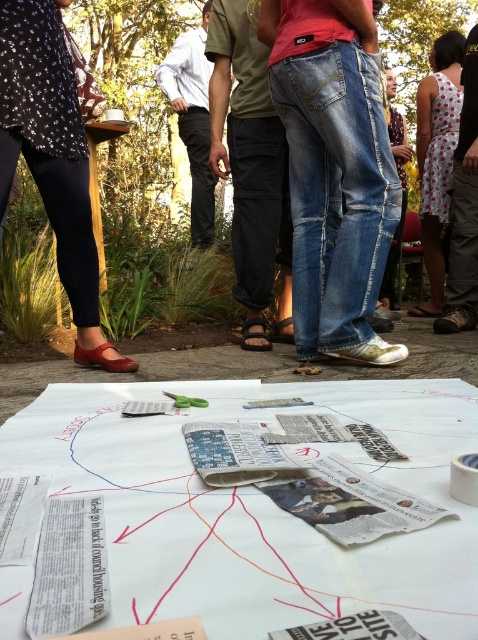
Between white dotted dress at center and jeans at center, which one has less height?

Standing shorter between the two is white dotted dress at center.

Who is positioned more to the right, white dotted dress at center or jeans at center?

white dotted dress at center

What do you see at coordinates (436, 157) in the screenshot? The width and height of the screenshot is (478, 640). I see `white dotted dress at center` at bounding box center [436, 157].

You are a GUI agent. You are given a task and a screenshot of the screen. Output one action in this format:
    pyautogui.click(x=<x>, y=<y>)
    Task: Click on the white dotted dress at center
    The width and height of the screenshot is (478, 640).
    Given the screenshot: What is the action you would take?
    pyautogui.click(x=436, y=157)

From the picture: Is denim jeans at center positioned behind white shirt at center?

No, denim jeans at center is in front of white shirt at center.

Is point (370, 157) in front of point (184, 99)?

Yes, it is.

The width and height of the screenshot is (478, 640). What are the coordinates of `denim jeans at center` in the screenshot? It's located at (334, 170).

Locate an element on the screen. The height and width of the screenshot is (640, 478). denim jeans at center is located at coordinates (334, 170).

Is matte black leggings at lower left to the right of white dotted dress at lower right from the viewer's perspective?

Incorrect, matte black leggings at lower left is not on the right side of white dotted dress at lower right.

Where is `matte black leggings at lower left`? This screenshot has width=478, height=640. matte black leggings at lower left is located at coordinates (53, 156).